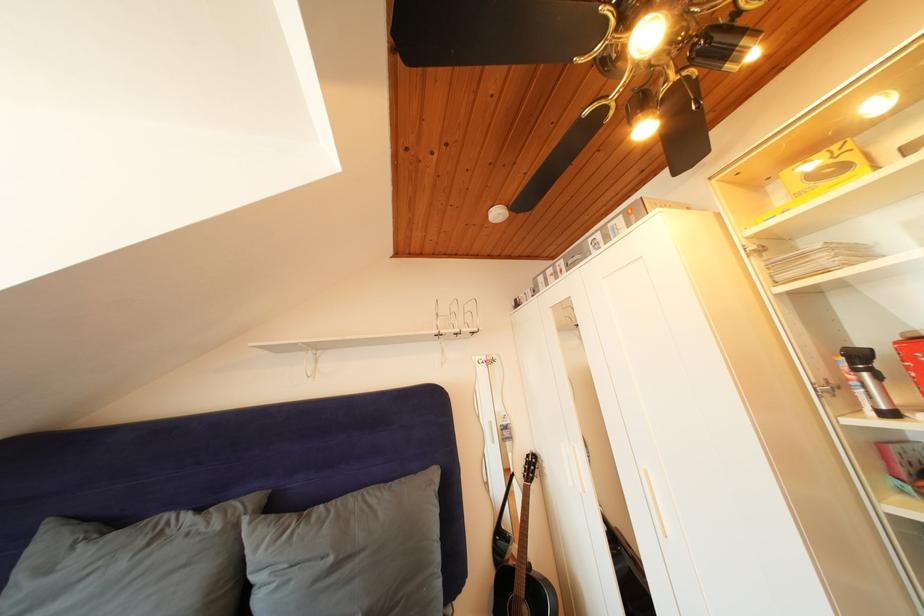
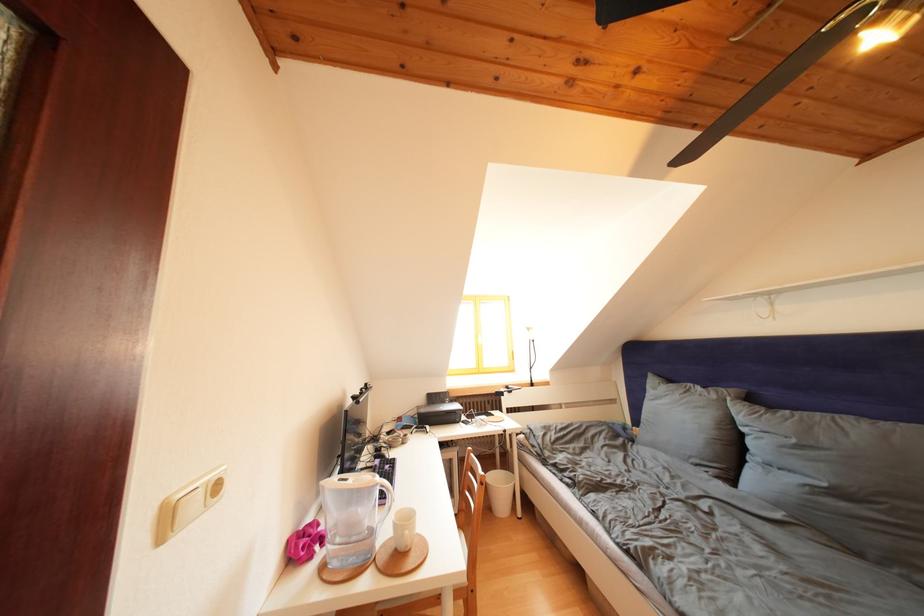
Where in the second image is the point corresponding to [338,565] from the first image?

(801, 446)